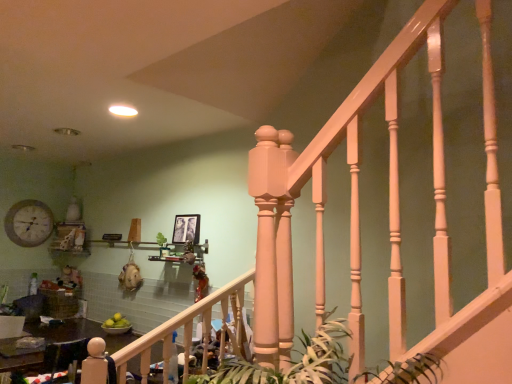
This screenshot has width=512, height=384. Describe the element at coordinates (78, 333) in the screenshot. I see `wooden table at lower left` at that location.

Find the location of a particular element. The image size is (512, 384). black matte picture frame at upper center is located at coordinates (186, 229).

The width and height of the screenshot is (512, 384). Describe the element at coordinates (29, 223) in the screenshot. I see `matte white clock at upper left` at that location.

The width and height of the screenshot is (512, 384). Identify the location of wooden table at lower left. (78, 333).

Find the location of a particular element. table located in front of the black matte picture frame at upper center is located at coordinates (78, 333).

Between black matte picture frame at upper center and wooden table at lower left, which one has more height?

wooden table at lower left is taller.

From the image's perspective, does black matte picture frame at upper center appear lower than wooden table at lower left?

Actually, black matte picture frame at upper center appears above wooden table at lower left in the image.

Is black matte picture frame at upper center in front of wooden table at lower left?

No.

Does green leafy plant at center appear on the right side of matte white clock at upper left?

Indeed, green leafy plant at center is positioned on the right side of matte white clock at upper left.

From a real-world perspective, is green leafy plant at center physically above matte white clock at upper left?

Result: No, from a real-world perspective, green leafy plant at center is not above matte white clock at upper left.

Is green leafy plant at center behind matte white clock at upper left?

No, green leafy plant at center is closer to the camera.

Is green leafy plant at center facing towards matte white railing at center?

No, green leafy plant at center is not turned towards matte white railing at center.

Is point (345, 374) positioned after point (243, 342)?

No.

Is green leafy plant at center inside or outside of matte white railing at center?

green leafy plant at center cannot be found inside matte white railing at center.

From the picture: Would you consider green leafy plant at center to be distant from matte white railing at center?

green leafy plant at center is positioned a significant distance from matte white railing at center.

Is matte white clock at upper left aimed at green leafy plant at center?

Yes, matte white clock at upper left is oriented towards green leafy plant at center.

From a real-world perspective, which object stands above the other?

In real-world perspective, matte white clock at upper left is above.

Considering the points (30, 232) and (289, 371), which point is in front, point (30, 232) or point (289, 371)?

The point (289, 371) is in front.

Can you confirm if green leafy plant at center is smaller than black matte picture frame at upper center?

Incorrect, green leafy plant at center is not smaller in size than black matte picture frame at upper center.

Is point (343, 323) positioned in front of point (195, 241)?

Yes, point (343, 323) is in front of point (195, 241).

Which is in front, green leafy plant at center or black matte picture frame at upper center?

green leafy plant at center is more forward.

From the picture: Which point is more distant from viewer, (x=31, y=221) or (x=186, y=238)?

The point (x=31, y=221) is behind.

Does matte white clock at upper left have a larger size compared to black matte picture frame at upper center?

Correct, matte white clock at upper left is larger in size than black matte picture frame at upper center.

Is matte white clock at upper left in contact with black matte picture frame at upper center?

matte white clock at upper left is not next to black matte picture frame at upper center, and they're not touching.

From the image's perspective, would you say matte white clock at upper left is shown under black matte picture frame at upper center?

Indeed, from the image's perspective, matte white clock at upper left is shown beneath black matte picture frame at upper center.

Where is `table below the matte white clock at upper left (from a real-world perspective)`? table below the matte white clock at upper left (from a real-world perspective) is located at coordinates (78, 333).

Can you confirm if matte white clock at upper left is bigger than wooden table at lower left?

Actually, matte white clock at upper left might be smaller than wooden table at lower left.

Is matte white clock at upper left facing away from wooden table at lower left?

matte white clock at upper left is not turned away from wooden table at lower left.

In the image, is matte white clock at upper left positioned in front of or behind wooden table at lower left?

matte white clock at upper left is behind wooden table at lower left.

Locate an element on the screen. This screenshot has height=384, width=512. table beneath the black matte picture frame at upper center (from a real-world perspective) is located at coordinates (78, 333).

Locate an element on the screen. Image resolution: width=512 pixels, height=384 pixels. plant on the right of matte white clock at upper left is located at coordinates (292, 362).

Based on their spatial positions, is wooden table at lower left or matte white clock at upper left further from black matte picture frame at upper center?

Among the two, matte white clock at upper left is located further to black matte picture frame at upper center.

Looking at the image, which one is located closer to matte white railing at center, wooden table at lower left or black matte picture frame at upper center?

The object closer to matte white railing at center is black matte picture frame at upper center.

From the image, which object appears to be farther from wooden table at lower left, black matte picture frame at upper center or green leafy plant at center?

green leafy plant at center is further to wooden table at lower left.

Looking at the image, which one is located closer to green leafy plant at center, matte white railing at center or wooden table at lower left?

matte white railing at center.

When comparing their distances from green leafy plant at center, does matte white clock at upper left or black matte picture frame at upper center seem further?

matte white clock at upper left is further to green leafy plant at center.

Considering their positions, is green leafy plant at center positioned further to matte white clock at upper left than wooden table at lower left?

Among the two, green leafy plant at center is located further to matte white clock at upper left.

From the image, which object appears to be nearer to black matte picture frame at upper center, matte white clock at upper left or wooden table at lower left?

The object closer to black matte picture frame at upper center is wooden table at lower left.

Which object lies further to the anchor point wooden table at lower left, matte white railing at center or black matte picture frame at upper center?

matte white railing at center.

This screenshot has height=384, width=512. In order to click on rail between green leafy plant at center and matte white clock at upper left from front to back in this screenshot , I will do [x=188, y=330].

At what (x,y) coordinates should I click in order to perform the action: click on rail located between green leafy plant at center and wooden table at lower left in the depth direction. Please return your answer as a coordinate pair (x, y). Image resolution: width=512 pixels, height=384 pixels. Looking at the image, I should click on (188, 330).

Locate an element on the screen. This screenshot has width=512, height=384. table positioned between matte white railing at center and black matte picture frame at upper center from near to far is located at coordinates (78, 333).

Locate an element on the screen. This screenshot has width=512, height=384. table between green leafy plant at center and matte white clock at upper left in the front-back direction is located at coordinates (78, 333).